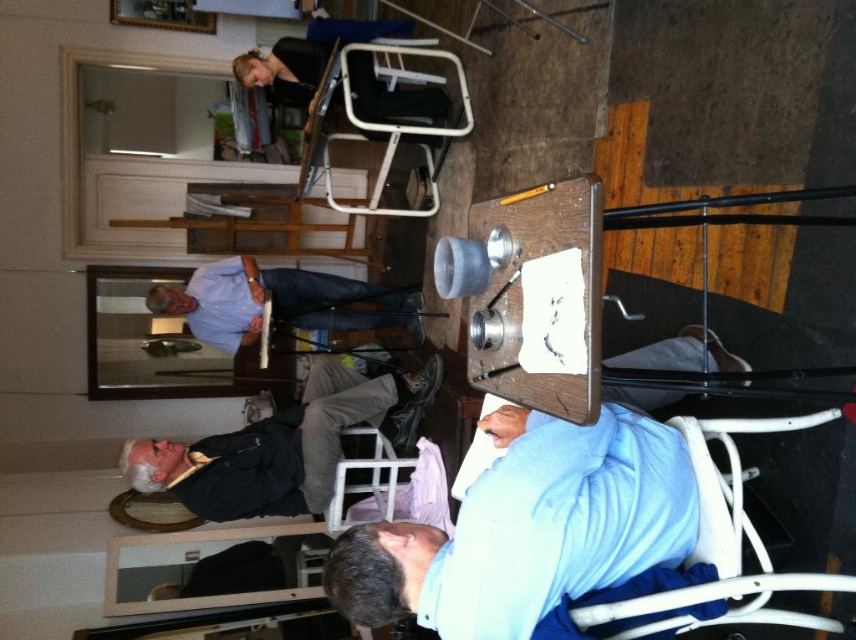
Between black leather jacket at lower left and white plastic chair at upper center, which one has more height?

white plastic chair at upper center is taller.

Can you confirm if black leather jacket at lower left is taller than white plastic chair at upper center?

No, black leather jacket at lower left is not taller than white plastic chair at upper center.

Which is behind, point (176, 481) or point (337, 204)?

The point (337, 204) is more distant.

Locate an element on the screen. black leather jacket at lower left is located at coordinates (278, 445).

From the picture: Does blue cotton shirt at lower right have a larger size compared to white plastic chair at upper center?

Actually, blue cotton shirt at lower right might be smaller than white plastic chair at upper center.

Does blue cotton shirt at lower right have a lesser width compared to white plastic chair at upper center?

Correct, blue cotton shirt at lower right's width is less than white plastic chair at upper center's.

What do you see at coordinates (528, 529) in the screenshot? I see `blue cotton shirt at lower right` at bounding box center [528, 529].

At what (x,y) coordinates should I click in order to perform the action: click on blue cotton shirt at lower right. Please return your answer as a coordinate pair (x, y). The width and height of the screenshot is (856, 640). Looking at the image, I should click on (528, 529).

Does point (253, 508) come in front of point (254, 317)?

Yes, it is in front of point (254, 317).

What are the coordinates of `black leather jacket at lower left` in the screenshot? It's located at (278, 445).

The width and height of the screenshot is (856, 640). Identify the location of black leather jacket at lower left. (278, 445).